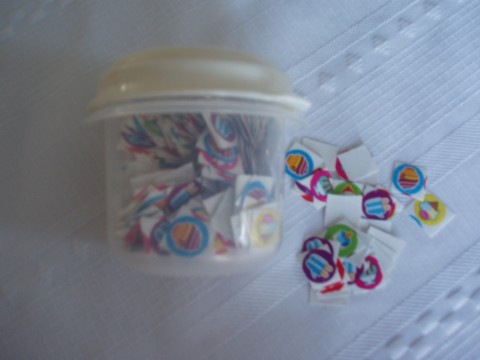
Where is `table cloth`? Image resolution: width=480 pixels, height=360 pixels. table cloth is located at coordinates (398, 113).